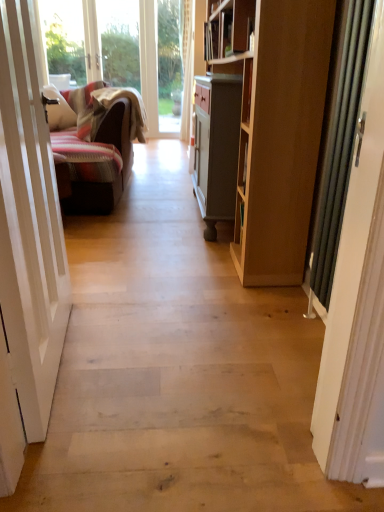
Where is `metallic silver door at right, which appears as the first door when viewed from the right`? This screenshot has height=512, width=384. metallic silver door at right, which appears as the first door when viewed from the right is located at coordinates point(357,305).

Identify the location of natural wood floor at center. (178, 371).

You are a GUI agent. You are given a task and a screenshot of the screen. Output one action in this format:
    pyautogui.click(x=<x>, y=<y>)
    Task: Click on the door lying below the metallic silver door at right, placed as the second door when sorted from left to right (from the image's perspective)
    The height and width of the screenshot is (512, 384).
    Given the screenshot: What is the action you would take?
    click(x=29, y=224)

Would you say metallic silver door at right, placed as the second door when sorted from left to right, contains white glossy door at left, which ranks as the 1th door in left-to-right order?

No.

Is metallic silver door at right, which appears as the first door when viewed from the right, placed right next to white glossy door at left, which appears as the second door when viewed from the right?

There is a gap between metallic silver door at right, which appears as the first door when viewed from the right, and white glossy door at left, which appears as the second door when viewed from the right.

Which is in front, point (355, 329) or point (46, 420)?

The point (355, 329) is closer to the camera.

Considering the relative positions of natural wood floor at center and metallic silver door at right, which appears as the first door when viewed from the right, in the image provided, is natural wood floor at center to the right of metallic silver door at right, which appears as the first door when viewed from the right, from the viewer's perspective?

Incorrect, natural wood floor at center is not on the right side of metallic silver door at right, which appears as the first door when viewed from the right.

Is natural wood floor at center bigger than metallic silver door at right, placed as the second door when sorted from left to right?

Yes.

Is natural wood floor at center oriented away from metallic silver door at right, placed as the second door when sorted from left to right?

No, metallic silver door at right, placed as the second door when sorted from left to right, is not at the back of natural wood floor at center.

In the scene shown: Which of these two, natural wood floor at center or metallic silver door at right, placed as the second door when sorted from left to right, stands taller?

Standing taller between the two is metallic silver door at right, placed as the second door when sorted from left to right.

Does white glossy door at left, which ranks as the 1th door in left-to-right order, turn towards metallic silver door at right, which appears as the first door when viewed from the right?

Yes, white glossy door at left, which ranks as the 1th door in left-to-right order, faces towards metallic silver door at right, which appears as the first door when viewed from the right.

Is the depth of white glossy door at left, which ranks as the 1th door in left-to-right order, less than that of metallic silver door at right, which appears as the first door when viewed from the right?

That is True.

From a real-world perspective, who is located higher, white glossy door at left, which appears as the second door when viewed from the right, or metallic silver door at right, placed as the second door when sorted from left to right?

In real-world perspective, white glossy door at left, which appears as the second door when viewed from the right, is above.

Locate an element on the screen. door in front of the metallic silver door at right, which appears as the first door when viewed from the right is located at coordinates (29, 224).

Are metallic silver door at right, which appears as the first door when viewed from the right, and natural wood floor at center beside each other?

There is a gap between metallic silver door at right, which appears as the first door when viewed from the right, and natural wood floor at center.

Is metallic silver door at right, placed as the second door when sorted from left to right, oriented towards natural wood floor at center?

No, metallic silver door at right, placed as the second door when sorted from left to right, is not oriented towards natural wood floor at center.

Which of these two, metallic silver door at right, which appears as the first door when viewed from the right, or natural wood floor at center, is bigger?

With larger size is natural wood floor at center.

Based on the photo, is natural wood floor at center a part of metallic silver door at right, placed as the second door when sorted from left to right?

No, natural wood floor at center is not a part of metallic silver door at right, placed as the second door when sorted from left to right.

From a real-world perspective, is natural wood floor at center positioned over white glossy door at left, which appears as the second door when viewed from the right, based on gravity?

No, from a real-world perspective, natural wood floor at center is not on top of white glossy door at left, which appears as the second door when viewed from the right.

From the picture: Is natural wood floor at center positioned beyond the bounds of white glossy door at left, which ranks as the 1th door in left-to-right order?

That's correct, natural wood floor at center is outside of white glossy door at left, which ranks as the 1th door in left-to-right order.

Is natural wood floor at center touching white glossy door at left, which ranks as the 1th door in left-to-right order?

No, natural wood floor at center is not next to white glossy door at left, which ranks as the 1th door in left-to-right order.

Could you tell me if natural wood floor at center is facing white glossy door at left, which ranks as the 1th door in left-to-right order?

Yes, natural wood floor at center is oriented towards white glossy door at left, which ranks as the 1th door in left-to-right order.

The image size is (384, 512). In order to click on the 1st door behind when counting from the natural wood floor at center in this screenshot , I will do `click(29, 224)`.

From the image's perspective, is white glossy door at left, which ranks as the 1th door in left-to-right order, located above or below natural wood floor at center?

Clearly, from the image's perspective, white glossy door at left, which ranks as the 1th door in left-to-right order, is above natural wood floor at center.

In the scene shown: Based on their positions, is white glossy door at left, which ranks as the 1th door in left-to-right order, located to the left or right of natural wood floor at center?

Clearly, white glossy door at left, which ranks as the 1th door in left-to-right order, is on the left of natural wood floor at center in the image.

Considering the sizes of white glossy door at left, which appears as the second door when viewed from the right, and natural wood floor at center in the image, is white glossy door at left, which appears as the second door when viewed from the right, taller or shorter than natural wood floor at center?

Considering their sizes, white glossy door at left, which appears as the second door when viewed from the right, has more height than natural wood floor at center.

Identify the location of door below the metallic silver door at right, which appears as the first door when viewed from the right (from the image's perspective). (29, 224).

The height and width of the screenshot is (512, 384). I want to click on path that appears in front of the metallic silver door at right, placed as the second door when sorted from left to right, so click(178, 371).

Estimate the real-world distances between objects in this image. Which object is further from natural wood floor at center, metallic silver door at right, which appears as the first door when viewed from the right, or white glossy door at left, which ranks as the 1th door in left-to-right order?

metallic silver door at right, which appears as the first door when viewed from the right, is further to natural wood floor at center.

Based on their spatial positions, is white glossy door at left, which appears as the second door when viewed from the right, or metallic silver door at right, placed as the second door when sorted from left to right, further from natural wood floor at center?

metallic silver door at right, placed as the second door when sorted from left to right, is positioned further to the anchor natural wood floor at center.

Based on their spatial positions, is natural wood floor at center or white glossy door at left, which ranks as the 1th door in left-to-right order, closer to metallic silver door at right, which appears as the first door when viewed from the right?

Among the two, natural wood floor at center is located nearer to metallic silver door at right, which appears as the first door when viewed from the right.

From the image, which object appears to be farther from metallic silver door at right, which appears as the first door when viewed from the right, white glossy door at left, which appears as the second door when viewed from the right, or natural wood floor at center?

Based on the image, white glossy door at left, which appears as the second door when viewed from the right, appears to be further to metallic silver door at right, which appears as the first door when viewed from the right.

Which object lies further to the anchor point white glossy door at left, which ranks as the 1th door in left-to-right order, metallic silver door at right, placed as the second door when sorted from left to right, or natural wood floor at center?

metallic silver door at right, placed as the second door when sorted from left to right, lies further to white glossy door at left, which ranks as the 1th door in left-to-right order, than the other object.

Based on their spatial positions, is natural wood floor at center or metallic silver door at right, which appears as the first door when viewed from the right, further from white glossy door at left, which appears as the second door when viewed from the right?

metallic silver door at right, which appears as the first door when viewed from the right, is further to white glossy door at left, which appears as the second door when viewed from the right.

Image resolution: width=384 pixels, height=512 pixels. Find the location of `path situated between white glossy door at left, which ranks as the 1th door in left-to-right order, and metallic silver door at right, placed as the second door when sorted from left to right, from left to right`. path situated between white glossy door at left, which ranks as the 1th door in left-to-right order, and metallic silver door at right, placed as the second door when sorted from left to right, from left to right is located at coordinates (178, 371).